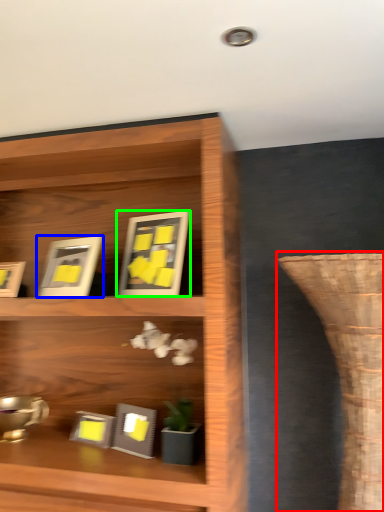
Question: Which is nearer to the vase (highlighted by a red box)? picture frame (highlighted by a blue box) or picture frame (highlighted by a green box).

Choices:
 (A) picture frame
 (B) picture frame

Answer: (B)